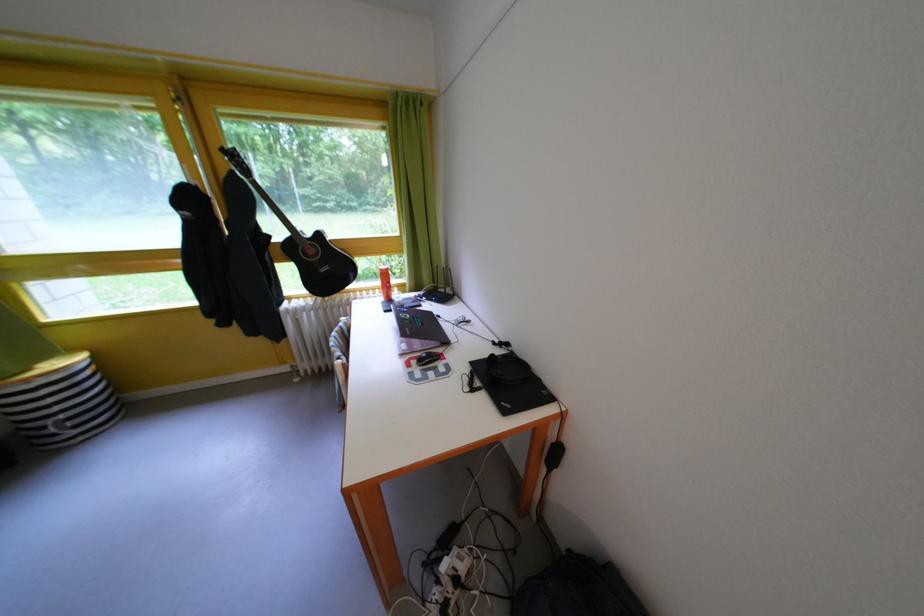
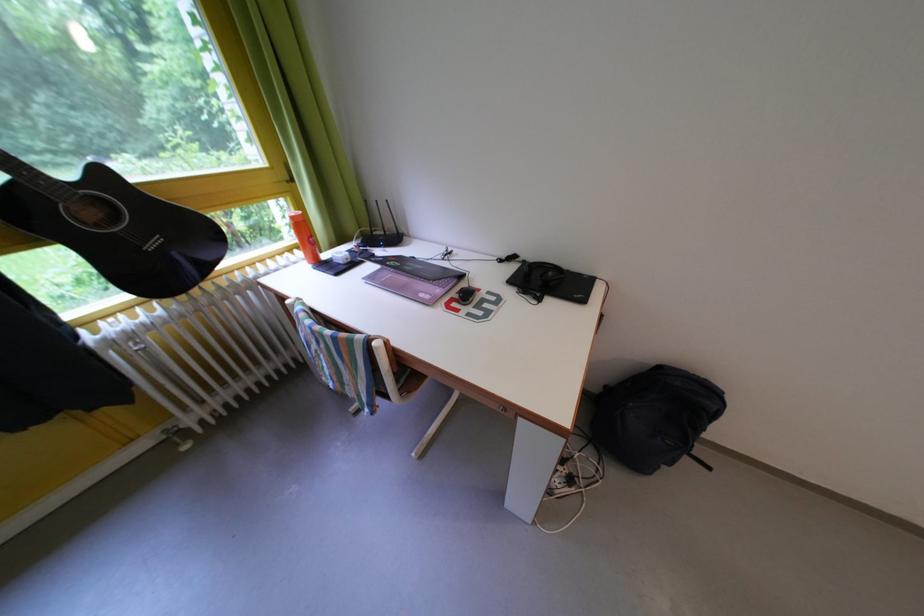
The point at (445, 318) is marked in the first image. Where is the corresponding point in the second image?

(417, 261)